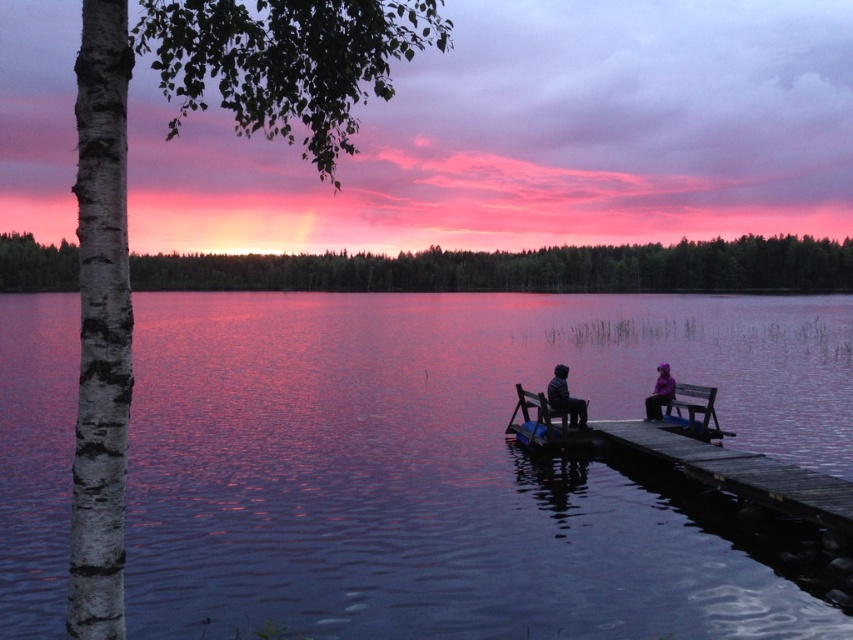
Does wooden dock at lower right come behind purple fabric jacket at lower right?

That is False.

Measure the distance between point (734, 449) and camera.

Point (734, 449) and camera are 54.06 feet apart from each other.

Between point (808, 515) and point (666, 376), which one is positioned behind?

Positioned behind is point (666, 376).

Where is `wooden dock at lower right`? The height and width of the screenshot is (640, 853). wooden dock at lower right is located at coordinates (741, 472).

Which is in front, point (387, 552) or point (573, 424)?

Point (387, 552) is in front.

Can you confirm if smooth water at center is smaller than dark blue fabric jacket at center?

No.

Is point (521, 304) more distant than point (547, 385)?

Yes, it is behind point (547, 385).

Where is `smooth water at center`? The image size is (853, 640). smooth water at center is located at coordinates (456, 465).

Does wooden dock at lower right appear over wooden bench at lower right?

No.

Does wooden dock at lower right have a smaller size compared to wooden bench at lower right?

Yes.

Is point (747, 497) positioned behind point (692, 396)?

No, it is in front of (692, 396).

Identify the location of wooden dock at lower right. The image size is (853, 640). (741, 472).